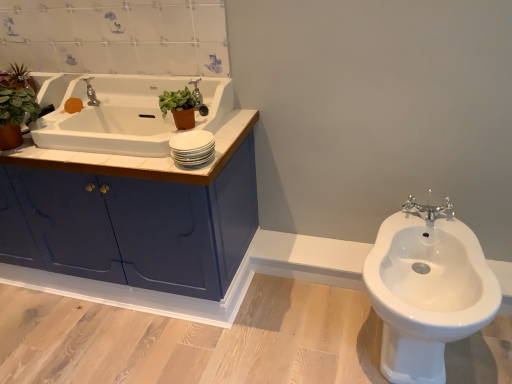
Locate an element on the screen. free space in front of chrome metallic tap at upper left, which is counted as the 1th tap, starting from the back is located at coordinates [96, 124].